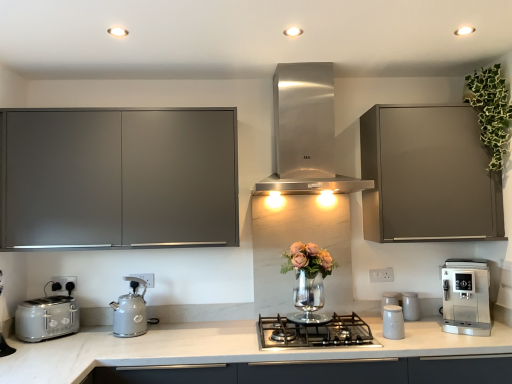
Identify the location of blank space situated above stainless steel range hood at center, acting as the 1th home appliance starting from the left (from a real-world perspective). (302, 62).